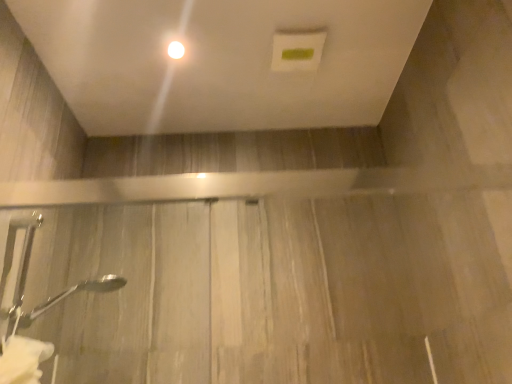
Describe the element at coordinates (176, 50) in the screenshot. I see `matte white droplight at upper center` at that location.

Identify the location of matte white droplight at upper center. (176, 50).

Measure the distance between point (183,48) and camera.

4.42 feet.

Where is `matte white droplight at upper center`? The height and width of the screenshot is (384, 512). matte white droplight at upper center is located at coordinates point(176,50).